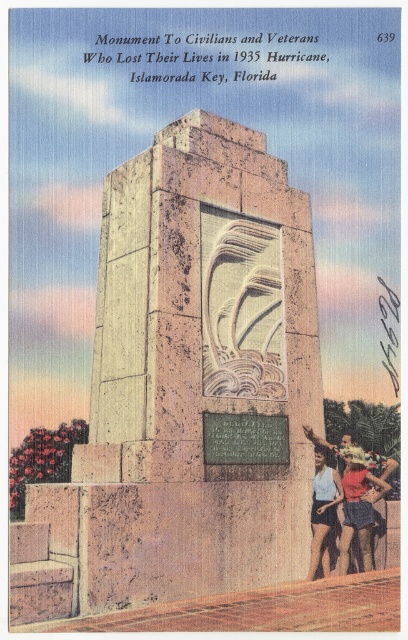
Who is more distant from viewer, (365,557) or (323,477)?

Point (365,557)

Who is more forward, (348, 460) or (314, 548)?

Point (314, 548)

Image resolution: width=408 pixels, height=640 pixels. I want to click on denim shorts at lower right, so click(357, 506).

Does matte blue swimsuit at lower right appear over light blue fabric shorts at lower right?

Actually, matte blue swimsuit at lower right is below light blue fabric shorts at lower right.

Is matte blue swimsuit at lower right below light blue fabric shorts at lower right?

Correct, matte blue swimsuit at lower right is located below light blue fabric shorts at lower right.

Does point (354, 449) come behind point (332, 520)?

That is True.

In order to click on matte blue swimsuit at lower right in this screenshot , I will do `click(359, 500)`.

Is matte blue swimsuit at lower right closer to the viewer compared to denim shorts at lower right?

Yes.

Is matte blue swimsuit at lower right to the left of denim shorts at lower right from the viewer's perspective?

Incorrect, matte blue swimsuit at lower right is not on the left side of denim shorts at lower right.

The height and width of the screenshot is (640, 408). What do you see at coordinates (359, 500) in the screenshot?
I see `matte blue swimsuit at lower right` at bounding box center [359, 500].

This screenshot has width=408, height=640. I want to click on matte blue swimsuit at lower right, so click(359, 500).